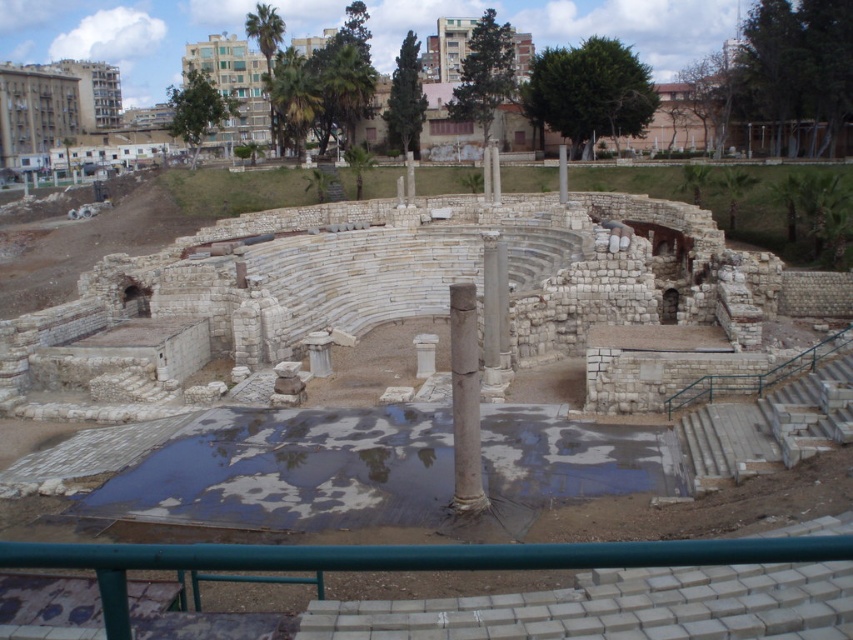
You are a construction worker tasked with placing a 3m wide metal beam across the amphitheater. You have to choose between placing it over the reflective concrete puddle at center or the gray stone column at center. Which location can accommodate the beam without bending or breaking it?

The reflective concrete puddle at center is wider than the gray stone column at center. Therefore, the 3m wide metal beam can be placed over the reflective concrete puddle at center as it has sufficient width to support the beam without bending or breaking it.

You are standing at the entrance of the amphitheater and see two points marked in the image. The first point is at coordinate point (189, 429) and the second point is at coordinate point (485, 252). Which point is closer to you?

Point (189, 429) is closer to the viewer than point (485, 252).

You are standing at the entrance of the ancient stone amphitheater and see two points marked in the image. The first point is at coordinates point (457, 406) and the second is at point (500, 250). Which point is closer to you?

Point (457, 406) is in front of point (500, 250), so the first point is closer to you.